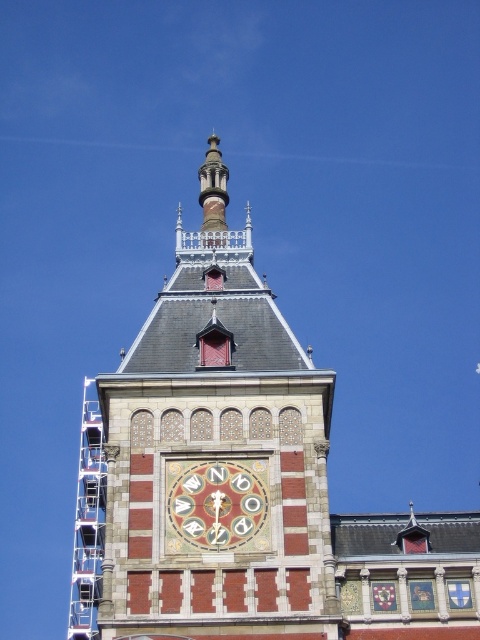
You are a maintenance worker needing to reach the marble clock face at center for repairs. You see the metal scaffolding at left. Is the scaffolding positioned below the clock face?

The marble clock face at center is above the metal scaffolding at left, so yes, the scaffolding is positioned below the clock face.

You are standing in front of a historic building and notice a point marked at coordinates (245, 464). Based on the scene described, what does this point most likely represent?

The point at (245, 464) most likely represents the brick clock tower at upper center as indicated by the Objects Description.

You are standing in front of the historic building and want to take a photo of the brick clock tower at upper center and the marble clock face at center. Which one will appear larger in your photo?

The brick clock tower at upper center will appear larger in the photo because it is closer to the viewer than the marble clock face at center.